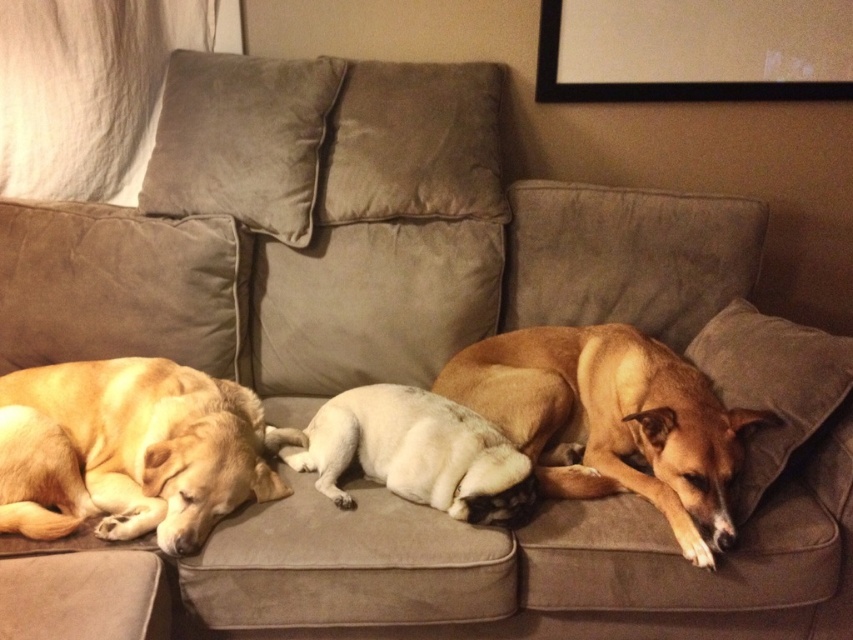
Question: From the image, what is the correct spatial relationship of golden fur dog at left in relation to black matte picture frame at upper right?

Choices:
 (A) below
 (B) above

Answer: (A)

Question: Is brown smooth dog at center positioned at the back of suede pillow at right?

Choices:
 (A) yes
 (B) no

Answer: (B)

Question: Which point is closer to the camera?

Choices:
 (A) (666, 355)
 (B) (778, 604)
 (C) (448, 486)
 (D) (825, 378)

Answer: (C)

Question: Is brown smooth dog at center above white fur dog at center?

Choices:
 (A) yes
 (B) no

Answer: (A)

Question: Which point is closer to the camera?

Choices:
 (A) (386, 460)
 (B) (703, 480)
 (C) (178, 164)

Answer: (B)

Question: Which of these objects is positioned closest to the black matte picture frame at upper right?

Choices:
 (A) golden fur dog at left
 (B) suede pillow at right
 (C) brown smooth dog at center
 (D) white fur dog at center

Answer: (B)